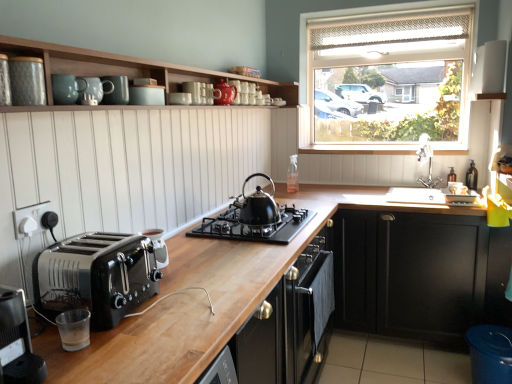
Locate an element on the screen. This screenshot has width=512, height=384. free point in front of black matte kettle at center is located at coordinates (249, 247).